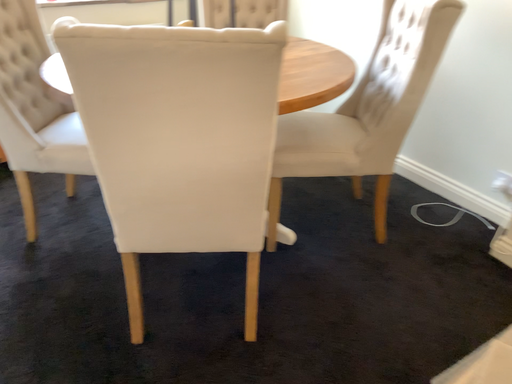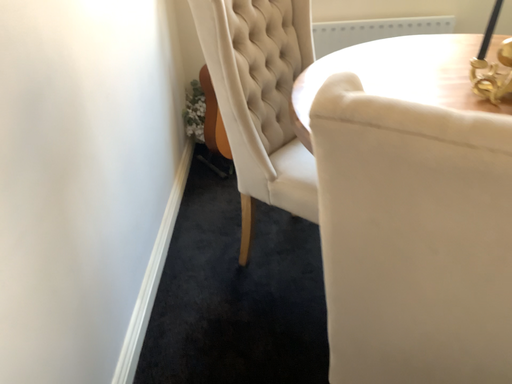
Question: How did the camera likely rotate when shooting the video?

Choices:
 (A) rotated left
 (B) rotated right

Answer: (A)